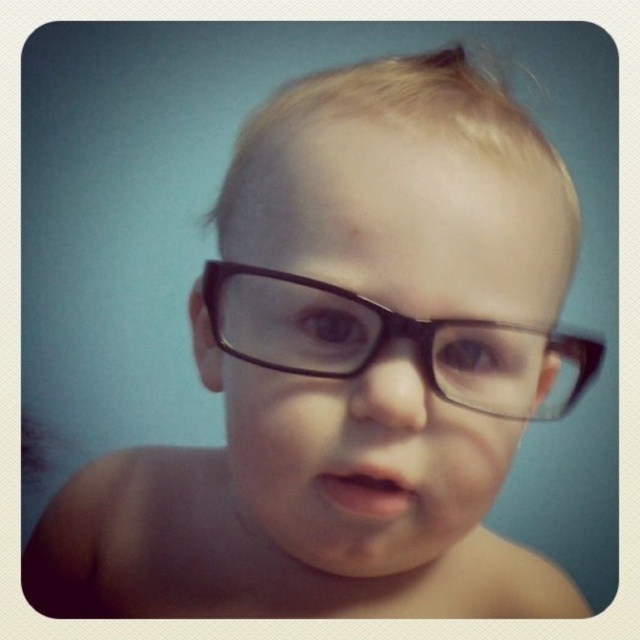
Consider the image. Is black matte glasses at center taller than black plastic glasses at center?

Indeed, black matte glasses at center has a greater height compared to black plastic glasses at center.

Does point (396, 515) come farther from viewer compared to point (545, 332)?

That is False.

Which is behind, point (397, 154) or point (536, 337)?

The point (536, 337) is more distant.

What are the coordinates of `black matte glasses at center` in the screenshot? It's located at (406, 221).